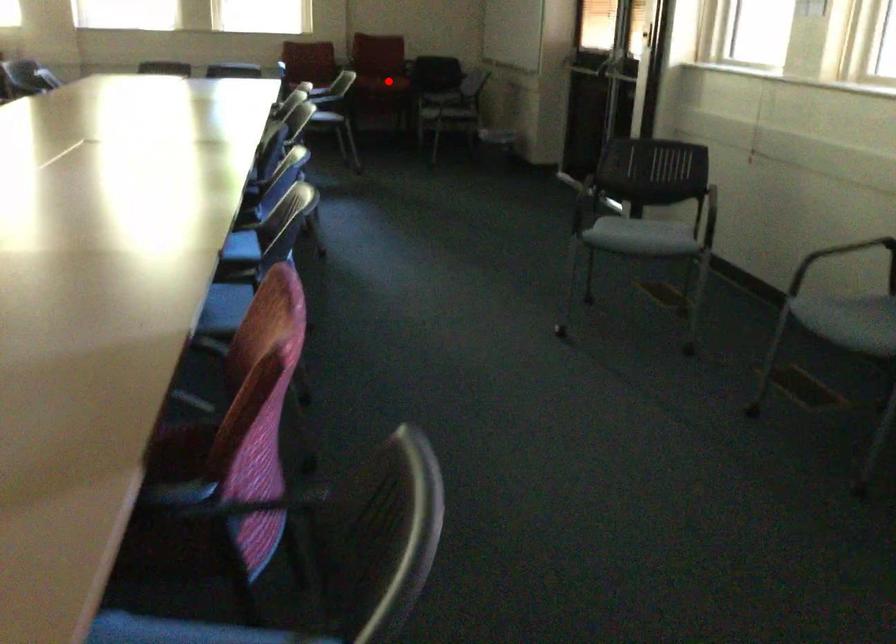
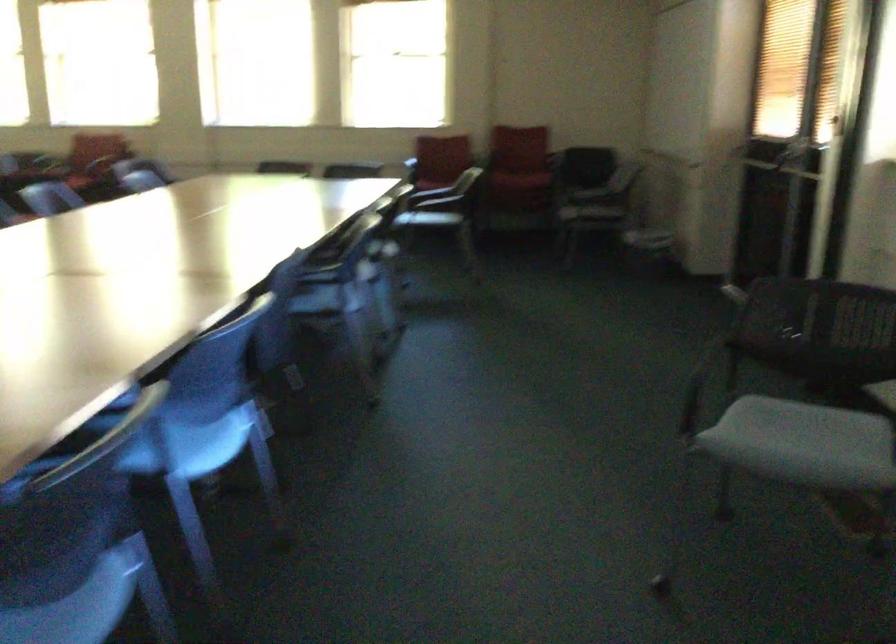
Find the pixel in the second image that matches the highlighted location in the first image.

(515, 192)